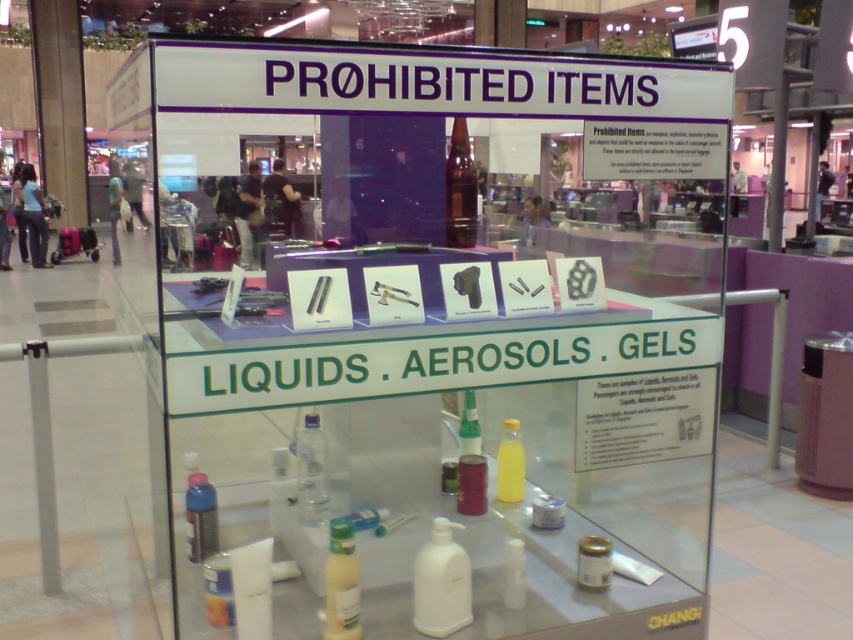
Does clear plastic bottle at center appear on the left side of translucent plastic bottle at lower left?

Incorrect, clear plastic bottle at center is not on the left side of translucent plastic bottle at lower left.

Is point (306, 420) closer to camera compared to point (196, 516)?

No, it is not.

Is point (320, 435) positioned in front of point (215, 509)?

No, it is behind (215, 509).

Find the location of `clear plastic bottle at center`. clear plastic bottle at center is located at coordinates pyautogui.click(x=310, y=472).

Can you confirm if translucent plastic bottle at center is positioned above green glass bottle at center?

No, translucent plastic bottle at center is not above green glass bottle at center.

Does point (345, 536) come behind point (479, 451)?

No, it is not.

Find the location of a particular element. The width and height of the screenshot is (853, 640). translucent plastic bottle at center is located at coordinates (341, 582).

Is clear plastic bottle at center behind yellow translucent bottle at center?

No, it is in front of yellow translucent bottle at center.

Does clear plastic bottle at center have a greater width compared to yellow translucent bottle at center?

Correct, the width of clear plastic bottle at center exceeds that of yellow translucent bottle at center.

Image resolution: width=853 pixels, height=640 pixels. In order to click on clear plastic bottle at center in this screenshot , I will do 310,472.